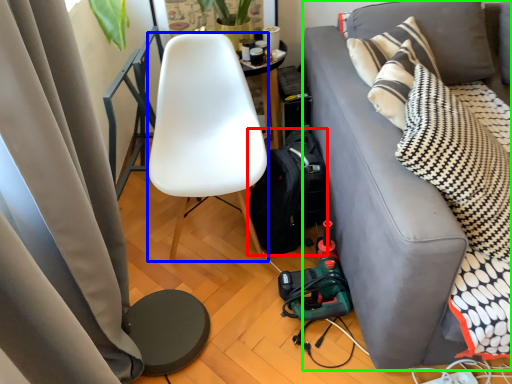
Question: Which is nearer to the backpack (highlighted by a red box)? chair (highlighted by a blue box) or studio couch (highlighted by a green box).

Choices:
 (A) chair
 (B) studio couch

Answer: (A)